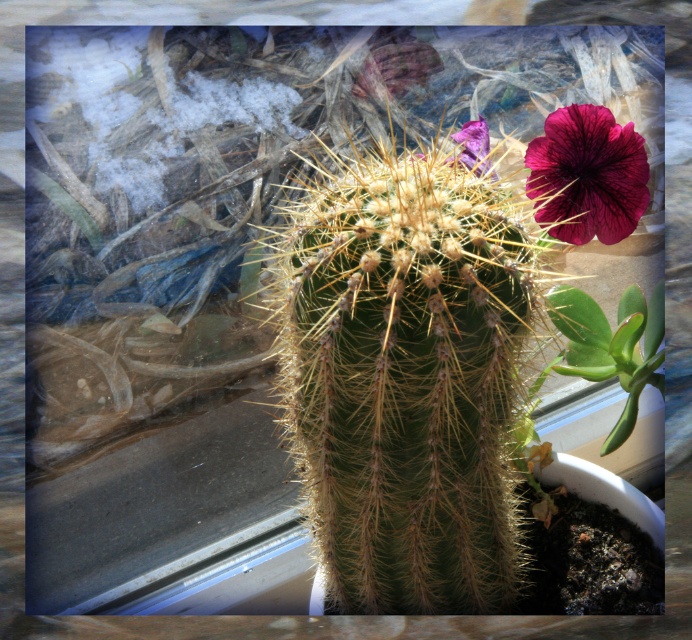
You are an interior designer planning to place a small decorative item on the windowsill. The windowsill is located at coordinates between x from 0.2 to 0.3 and y from 0.8 to 0.9. Will the dark purple petal at upper right interfere with placing the item there?

The dark purple petal at upper right is located at point (588, 176), which falls within the windowsill coordinates of x 0.2 to 0.3 and y 0.8 to 0.9. Therefore, placing the item there may interfere with the dark purple petal at upper right.

You are an interior designer arranging plants in a room. You have a dark purple petal at upper right and a purple matte flower at upper right. Which one is positioned lower in the scene?

The dark purple petal at upper right is positioned below the purple matte flower at upper right, so it is lower in the scene.